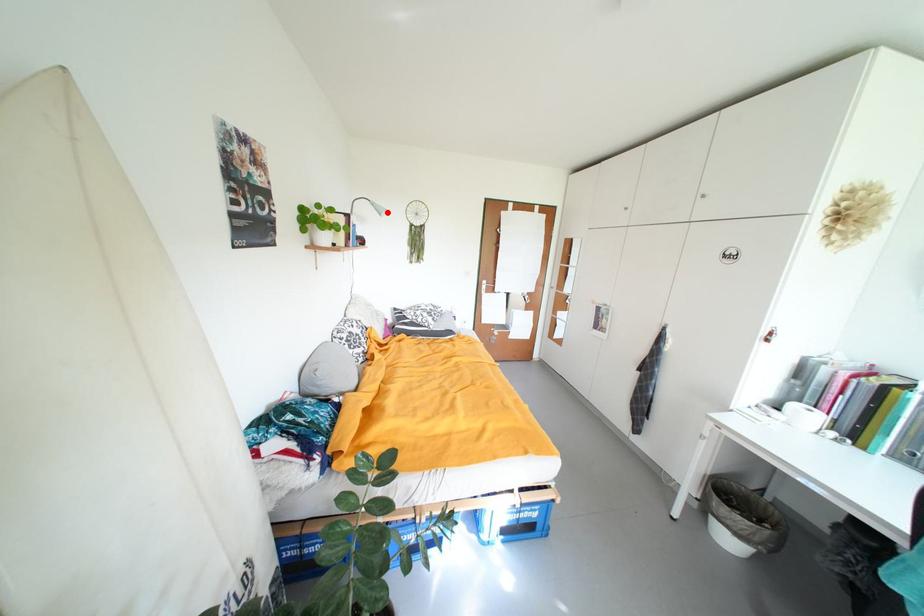
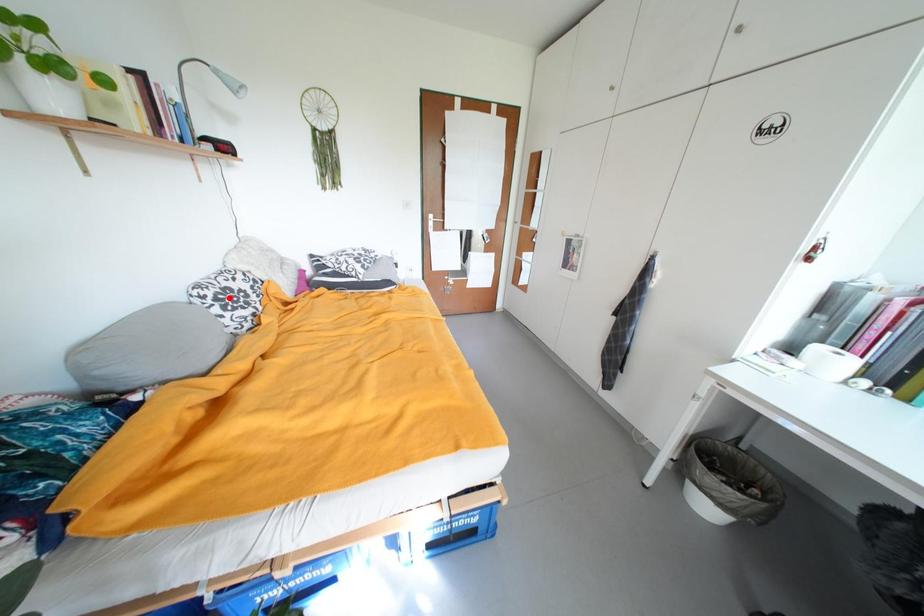
I am providing you with two images of the same scene from different viewpoints. A red point is marked on the first image and another point is marked on the second image. Is the marked point in image1 the same physical position as the marked point in image2?

No